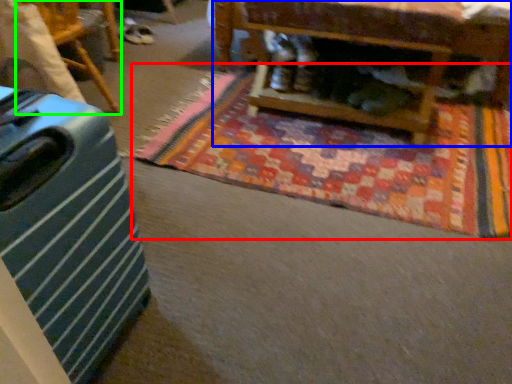
Question: Which object is positioned farthest from mat (highlighted by a red box)? Select from furniture (highlighted by a blue box) and furniture (highlighted by a green box).

Choices:
 (A) furniture
 (B) furniture

Answer: (B)